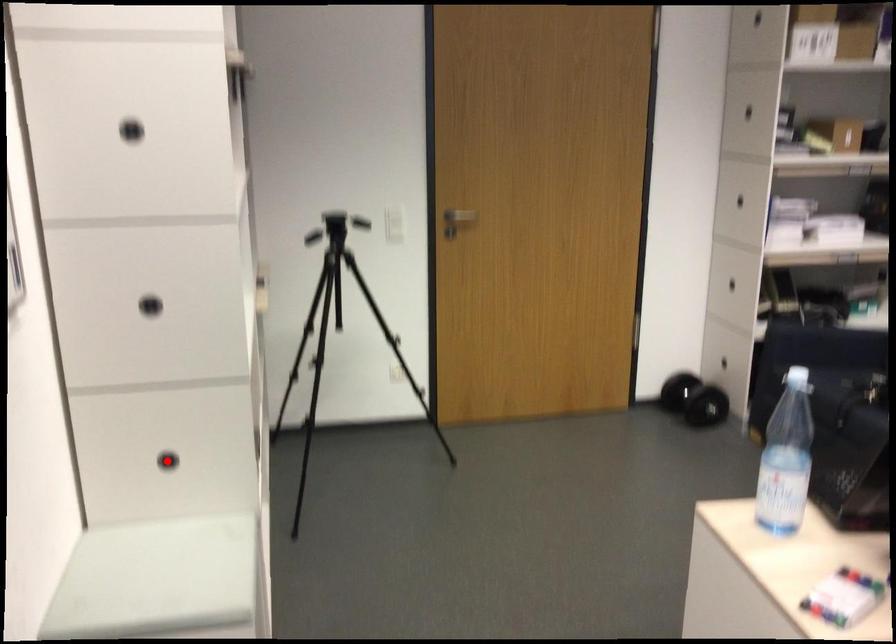
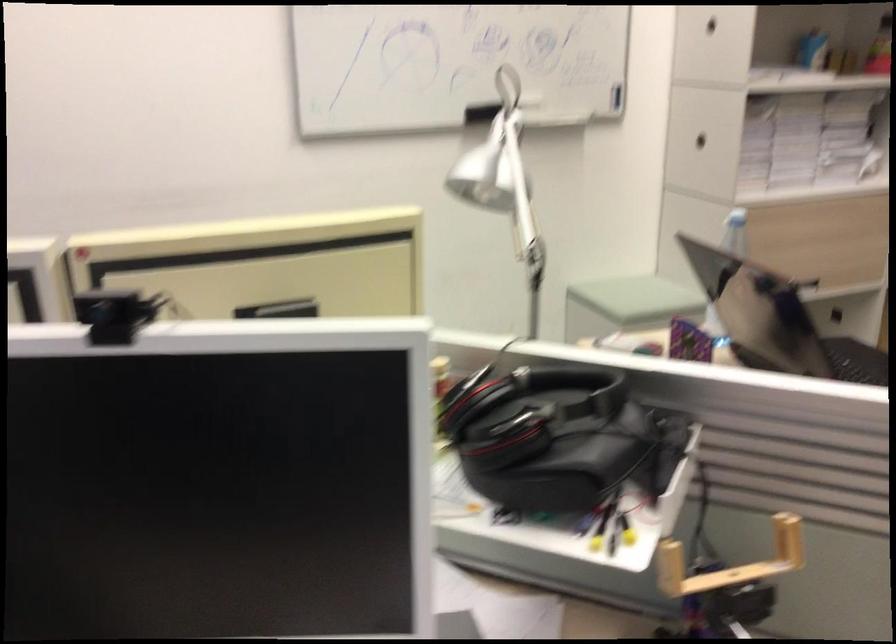
Question: I am providing you with two images of the same scene from different viewpoints. A red point is marked on the first image. Is the red point's position out of view in image 2?

Choices:
 (A) Yes
 (B) No

Answer: (A)